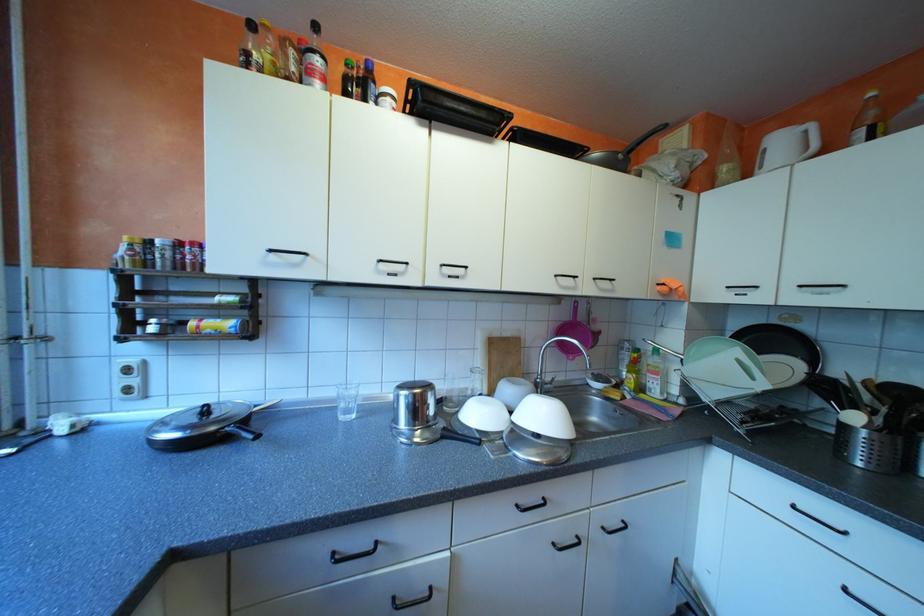
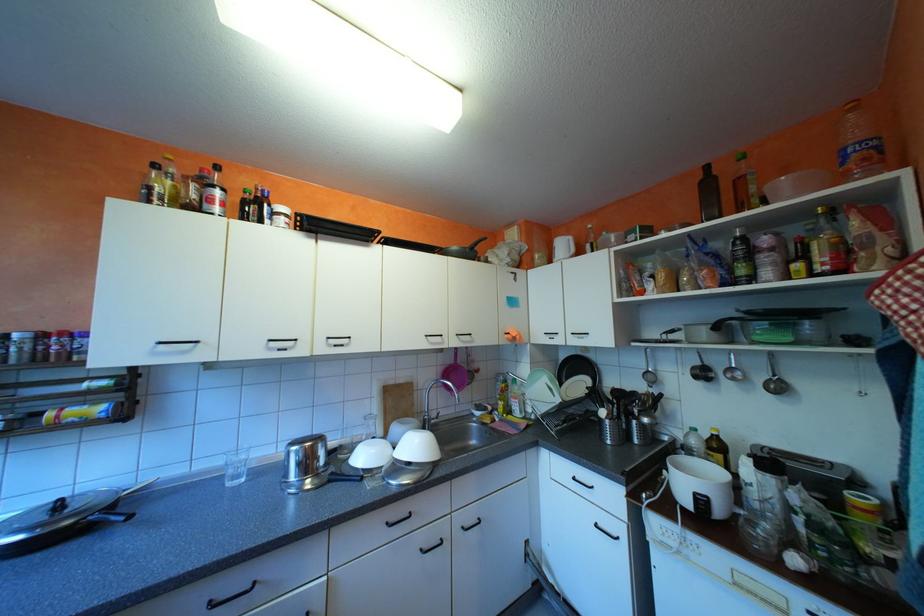
Question: The camera is either moving clockwise (left) or counter-clockwise (right) around the object. The first image is from the beginning of the video and the second image is from the end. Is the camera moving left or right when shooting the video?

Choices:
 (A) Left
 (B) Right

Answer: (A)